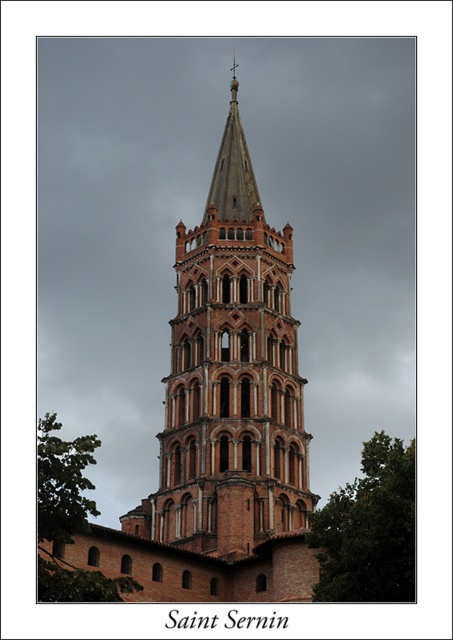
Is brown brick tower at center wider than green leafy tree at lower left?

Incorrect, brown brick tower at center's width does not surpass green leafy tree at lower left's.

Is point (163, 467) farther from camera compared to point (83, 476)?

No, (163, 467) is closer to viewer.

Is point (283, 440) positioned after point (75, 506)?

That is True.

Find the location of `brown brick tower at center`. brown brick tower at center is located at coordinates (231, 378).

Who is lower down, brown brick tower at center or green leafy tree at lower right?

Positioned lower is green leafy tree at lower right.

Which is in front, point (249, 253) or point (380, 572)?

Positioned in front is point (380, 572).

Locate an element on the screen. This screenshot has height=640, width=453. brown brick tower at center is located at coordinates (231, 378).

The image size is (453, 640). In order to click on green leafy tree at lower right in this screenshot , I will do `click(369, 529)`.

Does point (327, 557) lie behind point (70, 445)?

Yes.

Identify the location of green leafy tree at lower right. (369, 529).

Where is `green leafy tree at lower right`? The height and width of the screenshot is (640, 453). green leafy tree at lower right is located at coordinates (369, 529).